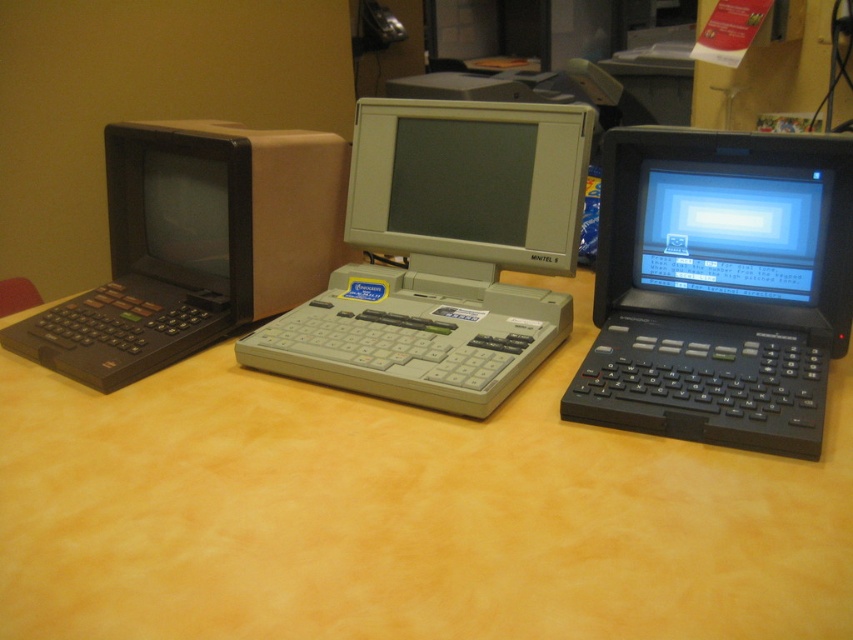
You are setting up a desk and need to place the gray plastic computer at center and the matte gray monitor at center. Which one should you place first if you want to ensure there is enough space for both?

You should place the gray plastic computer at center first because it is bigger than the matte gray monitor at center, ensuring there is enough space for both.

You are standing at the end of the table and want to pick up the black plastic laptop at right and the gray plastic computer at center. Which one can you reach without moving your position?

The black plastic laptop at right is closer to the viewer than the gray plastic computer at center, so you can reach the black plastic laptop at right without moving your position.

You are setting up a desk arrangement and need to place both the yellow wood table at center and the matte black laptop at left. Considering their heights, which object should be placed lower to ensure proper visibility when using the laptop?

The yellow wood table at center has a lesser height compared to the matte black laptop at left, so the yellow wood table at center should be placed lower to ensure proper visibility when using the laptop.